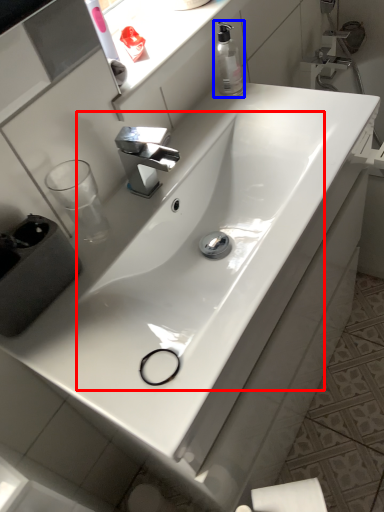
Question: Among these objects, which one is nearest to the camera, sink (highlighted by a red box) or soap dispenser (highlighted by a blue box)?

Choices:
 (A) sink
 (B) soap dispenser

Answer: (A)